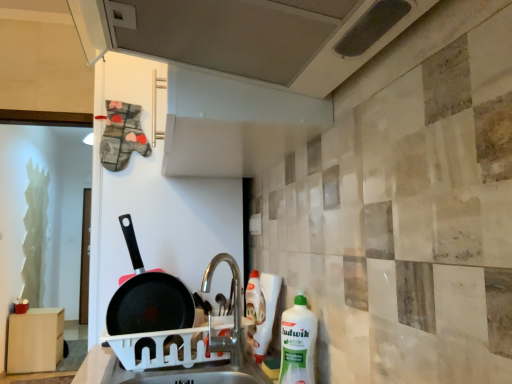
Question: In terms of height, does white plastic dish rack at sink look taller or shorter compared to white plastic sink at center?

Choices:
 (A) short
 (B) tall

Answer: (B)

Question: Do you think white plastic dish rack at sink is within white plastic sink at center, or outside of it?

Choices:
 (A) outside
 (B) inside

Answer: (A)

Question: Which object is positioned farthest from the metallic perforated exhaust hood at upper center?

Choices:
 (A) white plastic sink at center
 (B) black non-stick frying pan at center
 (C) light brown wood cabinet at lower left
 (D) white plastic dish rack at sink
 (E) white plastic bottle at right

Answer: (C)

Question: Which of these objects is positioned farthest from the silver metallic tap at center?

Choices:
 (A) light brown wood cabinet at lower left
 (B) metallic perforated exhaust hood at upper center
 (C) white plastic bottle at right
 (D) white plastic dish rack at sink
 (E) white plastic sink at center

Answer: (A)